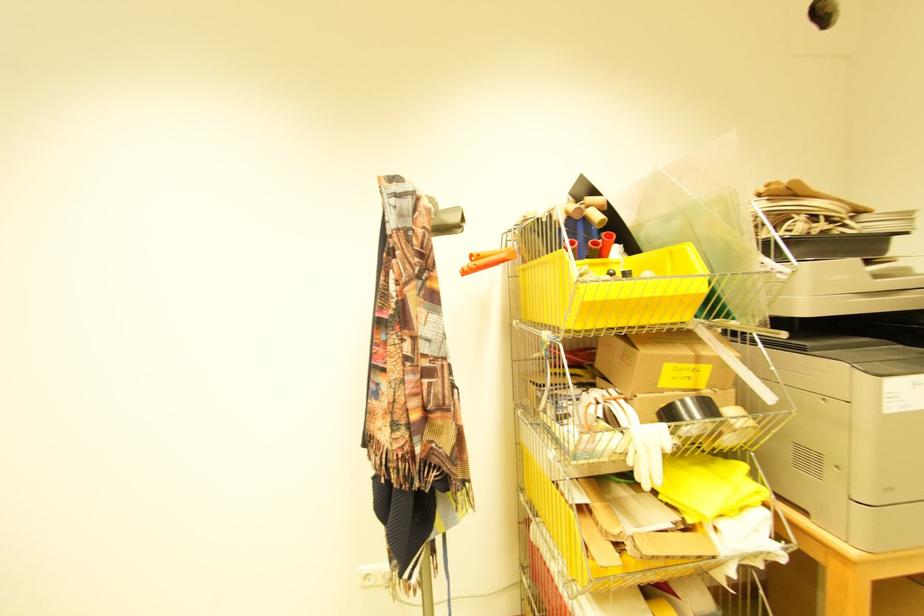
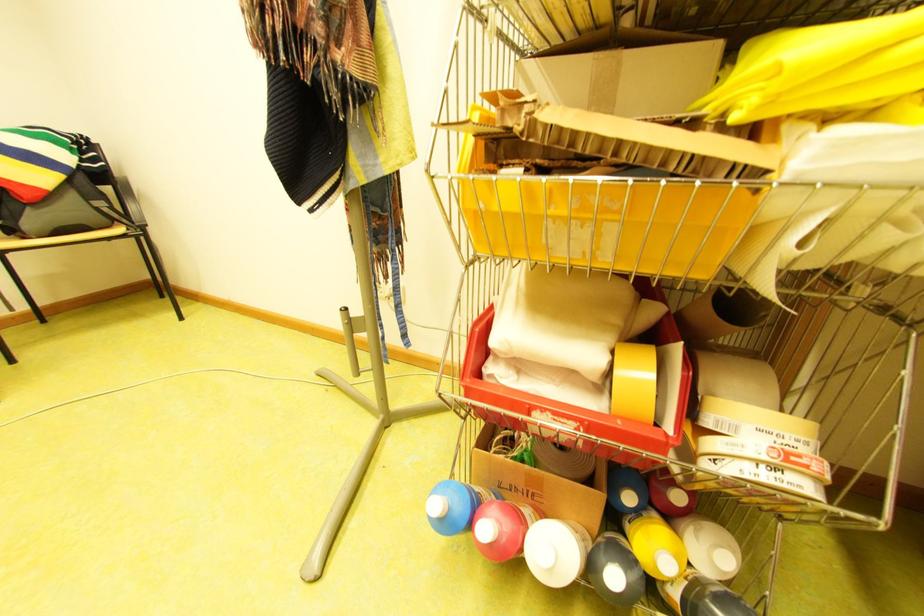
The images are taken continuously from a first-person perspective. In which direction is your viewpoint rotating?

The rotation direction of the camera is left-down.